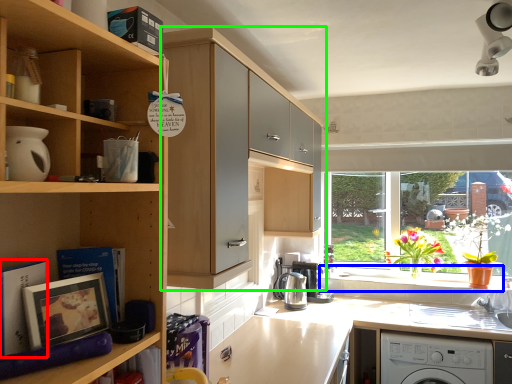
Question: Which object is the closest to the book (highlighted by a red box)? Choose among these: window sill (highlighted by a blue box) or cabinetry (highlighted by a green box).

Choices:
 (A) window sill
 (B) cabinetry

Answer: (B)